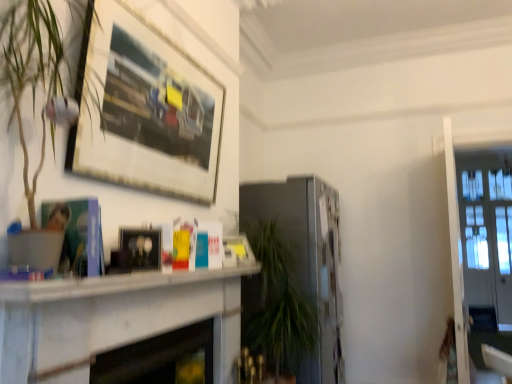
Question: Can you confirm if white marble fireplace at center is smaller than white marble fireplace at center, positioned as the 2th fireplace in back-to-front order?

Choices:
 (A) no
 (B) yes

Answer: (A)

Question: Is white marble fireplace at center, arranged as the 1th fireplace when viewed from the front, located within white marble fireplace at center?

Choices:
 (A) yes
 (B) no

Answer: (A)

Question: Is white marble fireplace at center behind white marble fireplace at center, placed as the 2th fireplace when sorted from right to left?

Choices:
 (A) no
 (B) yes

Answer: (A)

Question: Does white marble fireplace at center appear on the right side of white marble fireplace at center, the first fireplace in the left-to-right sequence?

Choices:
 (A) yes
 (B) no

Answer: (A)

Question: Is white marble fireplace at center thinner than white marble fireplace at center, arranged as the 1th fireplace when viewed from the front?

Choices:
 (A) yes
 (B) no

Answer: (A)

Question: Can you confirm if white marble fireplace at center is wider than white marble fireplace at center, positioned as the 2th fireplace in back-to-front order?

Choices:
 (A) no
 (B) yes

Answer: (A)

Question: Does wooden picture frame at upper left, which appears as the 1th picture frame when viewed from the top, have a greater height compared to clear glass door at right?

Choices:
 (A) no
 (B) yes

Answer: (A)

Question: Considering the relative sizes of wooden picture frame at upper left, which appears as the 1th picture frame when viewed from the top, and clear glass door at right in the image provided, is wooden picture frame at upper left, which appears as the 1th picture frame when viewed from the top, shorter than clear glass door at right?

Choices:
 (A) no
 (B) yes

Answer: (B)

Question: Is wooden picture frame at upper left, which appears as the 1th picture frame when viewed from the top, next to clear glass door at right?

Choices:
 (A) no
 (B) yes

Answer: (A)

Question: Considering the relative positions of wooden picture frame at upper left, which appears as the 1th picture frame when viewed from the top, and clear glass door at right in the image provided, is wooden picture frame at upper left, which appears as the 1th picture frame when viewed from the top, to the right of clear glass door at right from the viewer's perspective?

Choices:
 (A) no
 (B) yes

Answer: (A)

Question: Would you say wooden picture frame at upper left, which appears as the 1th picture frame when viewed from the top, contains clear glass door at right?

Choices:
 (A) yes
 (B) no

Answer: (B)

Question: Does white marble fireplace at center, positioned as the 2th fireplace in back-to-front order, appear on the left side of satin silver fireplace at center, the 2th fireplace in the front-to-back sequence?

Choices:
 (A) yes
 (B) no

Answer: (A)